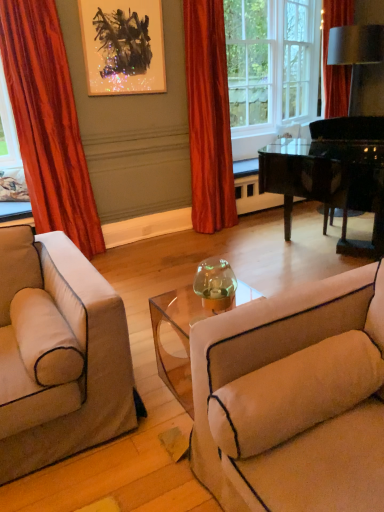
The width and height of the screenshot is (384, 512). I want to click on free space in front of silky orange curtain at center, acting as the 2th curtain starting from the left, so click(216, 241).